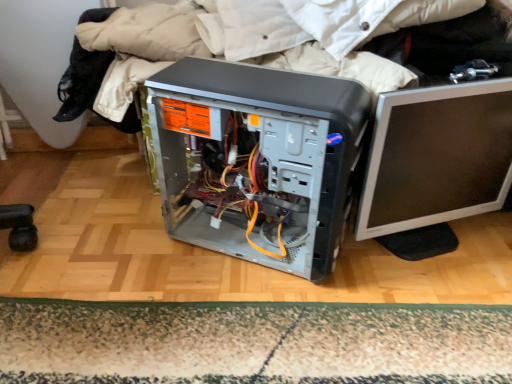
Find the location of a particular element. blank space to the left of satin black computer tower at center is located at coordinates (127, 256).